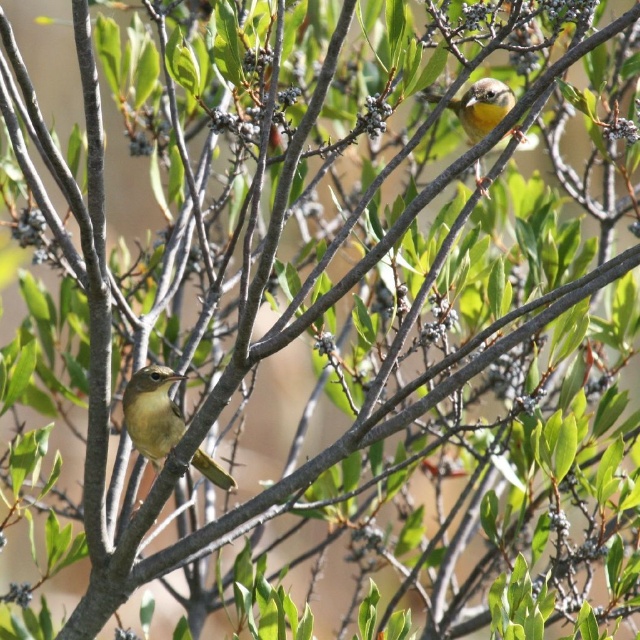
Image resolution: width=640 pixels, height=640 pixels. What are the coordinates of `green matte bird at center` in the screenshot? It's located at (152, 412).

What do you see at coordinates (152, 412) in the screenshot? I see `green matte bird at center` at bounding box center [152, 412].

Where is `green matte bird at center`? Image resolution: width=640 pixels, height=640 pixels. green matte bird at center is located at coordinates (152, 412).